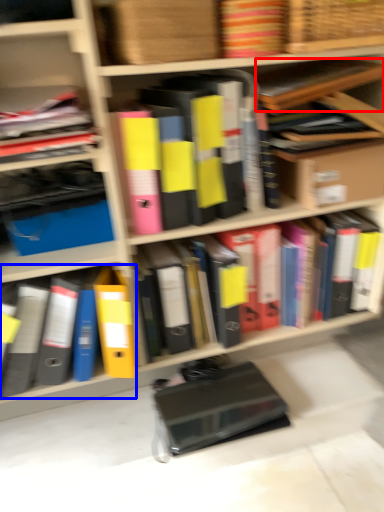
Question: Which object is closer to the camera taking this photo, book (highlighted by a red box) or book (highlighted by a blue box)?

Choices:
 (A) book
 (B) book

Answer: (A)